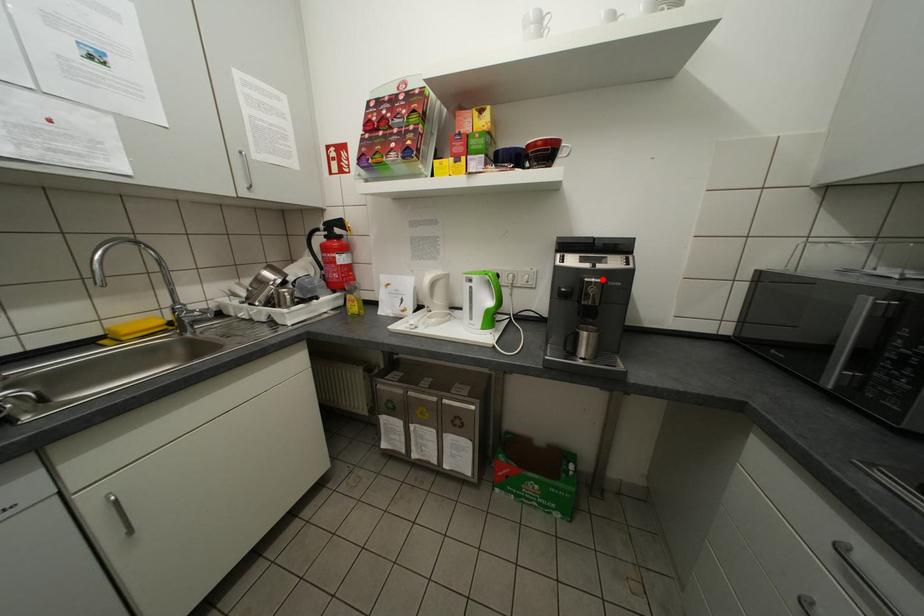
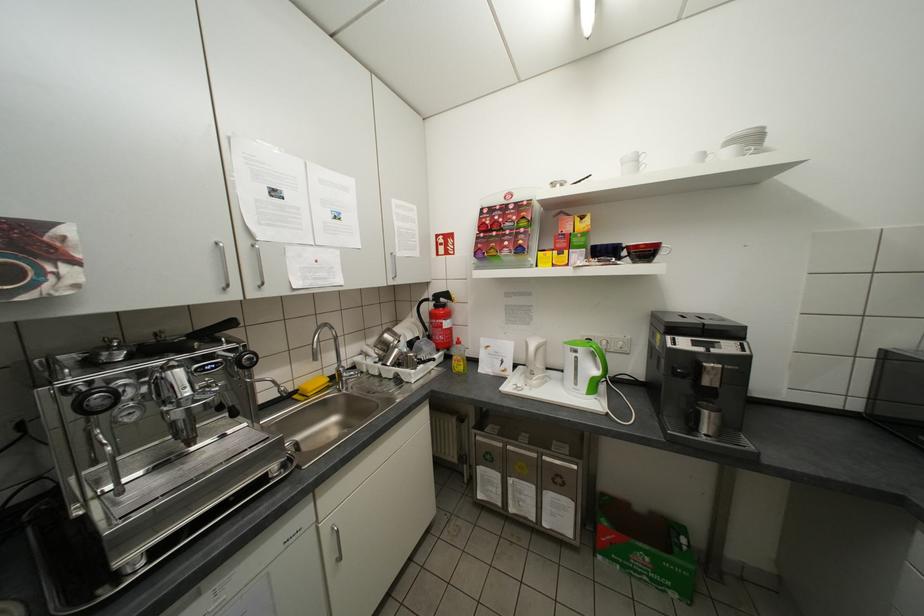
Where in the second image is the point corresponding to the highlighted location from the first image?

(721, 365)